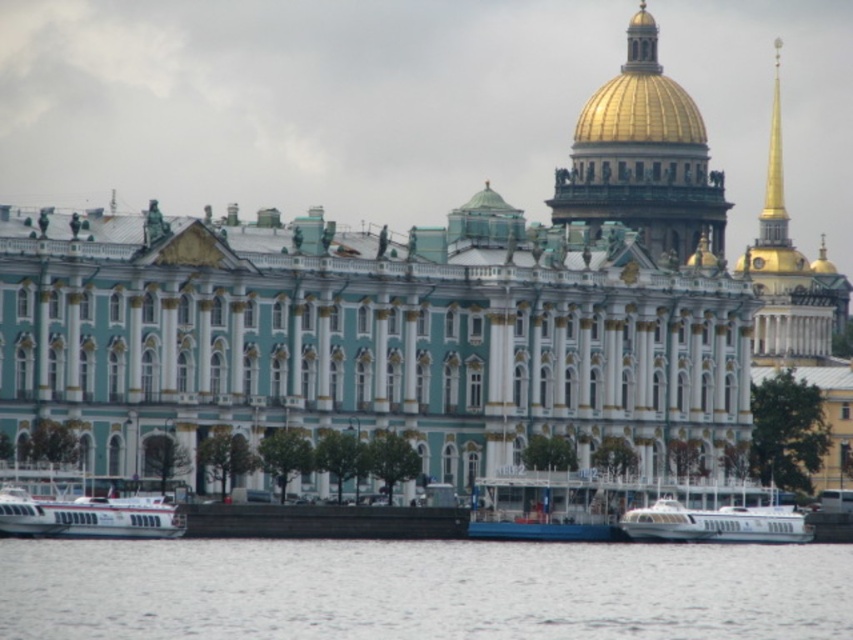
Question: Does white matte boat at lower left have a smaller size compared to white glossy boat at lower center?

Choices:
 (A) no
 (B) yes

Answer: (A)

Question: Does white matte boat at lower left have a smaller size compared to white glossy boat at lower center?

Choices:
 (A) no
 (B) yes

Answer: (A)

Question: Among these objects, which one is nearest to the camera?

Choices:
 (A) white glossy boat at lower center
 (B) gold polished dome at upper center
 (C) blue painted metal boat at center

Answer: (A)

Question: Among these points, which one is farthest from the camera?

Choices:
 (A) (679, 541)
 (B) (618, 108)
 (C) (82, 515)

Answer: (B)

Question: Does gold polished dome at upper center have a lesser width compared to white glossy boat at lower center?

Choices:
 (A) yes
 (B) no

Answer: (B)

Question: Which is farther from the white matte boat at lower left?

Choices:
 (A) gold polished dome at upper center
 (B) blue painted metal boat at center
 (C) white water at lower center
 (D) white glossy boat at lower center

Answer: (A)